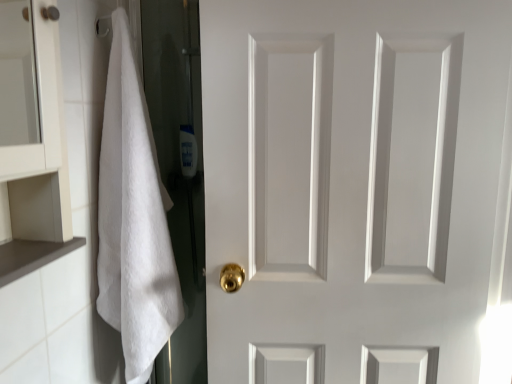
Question: Does white fluffy towel at left contain translucent plastic bottle at center?

Choices:
 (A) yes
 (B) no

Answer: (B)

Question: Could you tell me if white fluffy towel at left is facing translucent plastic bottle at center?

Choices:
 (A) yes
 (B) no

Answer: (B)

Question: Is white fluffy towel at left positioned far away from translucent plastic bottle at center?

Choices:
 (A) yes
 (B) no

Answer: (B)

Question: Is white fluffy towel at left to the right of translucent plastic bottle at center from the viewer's perspective?

Choices:
 (A) yes
 (B) no

Answer: (B)

Question: Considering the relative sizes of white fluffy towel at left and translucent plastic bottle at center in the image provided, is white fluffy towel at left thinner than translucent plastic bottle at center?

Choices:
 (A) no
 (B) yes

Answer: (A)

Question: Considering the positions of point (154, 339) and point (77, 238), is point (154, 339) closer or farther from the camera than point (77, 238)?

Choices:
 (A) farther
 (B) closer

Answer: (A)

Question: Considering their positions, is white fluffy towel at left located in front of or behind brown matte cabinet at lower left?

Choices:
 (A) front
 (B) behind

Answer: (B)

Question: Visually, is white fluffy towel at left positioned to the left or to the right of brown matte cabinet at lower left?

Choices:
 (A) right
 (B) left

Answer: (A)

Question: Is white fluffy towel at left inside or outside of brown matte cabinet at lower left?

Choices:
 (A) inside
 (B) outside

Answer: (B)

Question: In the image, is white matte door at center positioned in front of or behind translucent plastic bottle at center?

Choices:
 (A) behind
 (B) front

Answer: (B)

Question: Based on their sizes in the image, would you say white matte door at center is bigger or smaller than translucent plastic bottle at center?

Choices:
 (A) big
 (B) small

Answer: (A)

Question: From the image's perspective, is white matte door at center located above or below translucent plastic bottle at center?

Choices:
 (A) above
 (B) below

Answer: (B)

Question: In the image, is white matte door at center on the left side or the right side of translucent plastic bottle at center?

Choices:
 (A) left
 (B) right

Answer: (B)

Question: From the image's perspective, is brown matte cabinet at lower left positioned above or below white fluffy towel at left?

Choices:
 (A) below
 (B) above

Answer: (A)

Question: In terms of width, does brown matte cabinet at lower left look wider or thinner when compared to white fluffy towel at left?

Choices:
 (A) thin
 (B) wide

Answer: (A)